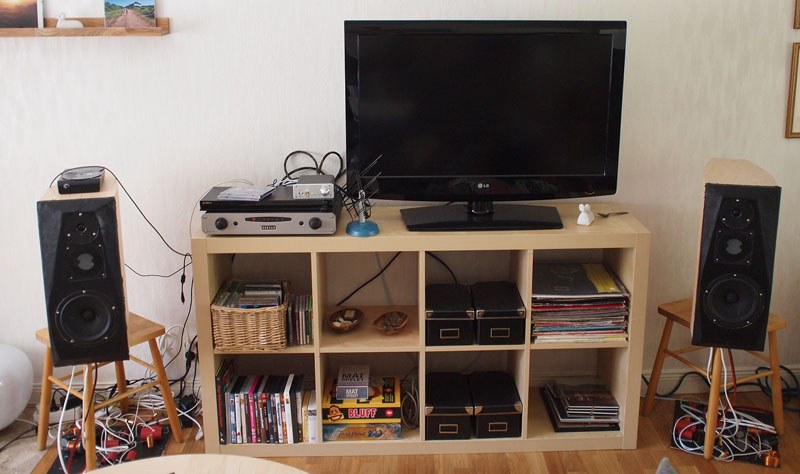
This screenshot has height=474, width=800. In order to click on tv in this screenshot , I will do `click(488, 127)`.